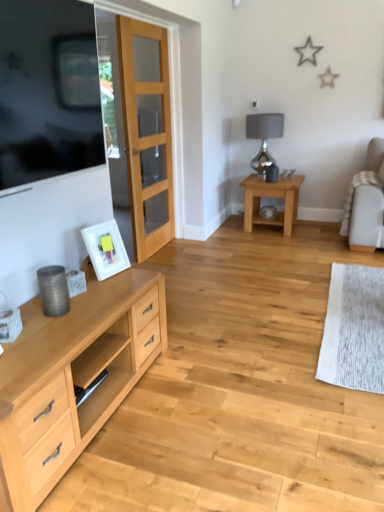
I want to click on white matte picture frame at left, so click(106, 249).

The image size is (384, 512). Describe the element at coordinates (10, 325) in the screenshot. I see `matte gray coffee cup at lower left` at that location.

Identify the location of silver metallic lamp at upper right. (264, 136).

In order to click on light brown wooden table at center-right in this screenshot , I will do `click(273, 197)`.

Measure the distance between point (142,23) and camera.

3.61 meters.

This screenshot has width=384, height=512. What do you see at coordinates (147, 133) in the screenshot?
I see `clear glass door at center` at bounding box center [147, 133].

What are the coordinates of `white matte picture frame at left` in the screenshot? It's located at [x=106, y=249].

Find the location of a particular element. chair that is behind the matte black tv at left is located at coordinates (366, 202).

From the picture: Is white fabric chair at right taller or shorter than matte black tv at left?

white fabric chair at right is shorter than matte black tv at left.

Does white fabric chair at right touch matte black tv at left?

white fabric chair at right and matte black tv at left are not in contact.

Is clear glass door at center behind white matte picture frame at left?

Yes, the depth of clear glass door at center is greater than that of white matte picture frame at left.

Based on the photo, from the image's perspective, which one is positioned lower, clear glass door at center or white matte picture frame at left?

white matte picture frame at left.

Is clear glass door at center oriented towards white matte picture frame at left?

No, clear glass door at center does not turn towards white matte picture frame at left.

Considering the relative sizes of clear glass door at center and matte gray coffee cup at lower left in the image provided, is clear glass door at center thinner than matte gray coffee cup at lower left?

No, clear glass door at center is not thinner than matte gray coffee cup at lower left.

From a real-world perspective, is clear glass door at center located beneath matte gray coffee cup at lower left?

Incorrect, from a real-world perspective, clear glass door at center is higher than matte gray coffee cup at lower left.

What's the angular difference between clear glass door at center and matte gray coffee cup at lower left's facing directions?

19.8 degrees separate the facing orientations of clear glass door at center and matte gray coffee cup at lower left.

Does point (127, 110) appear closer or farther from the camera than point (16, 322)?

Point (127, 110) is farther from the camera than point (16, 322).

Do you think light brown wooden table at center-right is within matte gray coffee cup at lower left, or outside of it?

The correct answer is: outside.

From the image's perspective, which one is positioned lower, light brown wooden table at center-right or matte gray coffee cup at lower left?

matte gray coffee cup at lower left, from the image's perspective.

Consider the image. How much distance is there between light brown wooden table at center-right and matte gray coffee cup at lower left?

light brown wooden table at center-right is 10.50 feet from matte gray coffee cup at lower left.

Locate an element on the screen. table behind the white fabric chair at right is located at coordinates (273, 197).

Is light brown wooden table at center-right not near white fabric chair at right?

light brown wooden table at center-right is actually quite close to white fabric chair at right.

Between light brown wooden table at center-right and white fabric chair at right, which one has less height?

Standing shorter between the two is light brown wooden table at center-right.

Identify the location of door located behind the white matte picture frame at left. The image size is (384, 512). (147, 133).

Considering the sizes of objects white matte picture frame at left and clear glass door at center in the image provided, who is thinner, white matte picture frame at left or clear glass door at center?

white matte picture frame at left is thinner.

From the picture: How many degrees apart are the facing directions of white matte picture frame at left and clear glass door at center?

13.1 degrees separate the facing orientations of white matte picture frame at left and clear glass door at center.

Is white matte picture frame at left located outside clear glass door at center?

Yes, white matte picture frame at left is located beyond the bounds of clear glass door at center.

Does white matte picture frame at left turn towards matte gray coffee cup at lower left?

No, white matte picture frame at left is not aimed at matte gray coffee cup at lower left.

From the image's perspective, does white matte picture frame at left appear lower than matte gray coffee cup at lower left?

Actually, white matte picture frame at left appears above matte gray coffee cup at lower left in the image.

In the image, there is a matte gray coffee cup at lower left. Where is `picture frame above it (from the image's perspective)`? picture frame above it (from the image's perspective) is located at coordinates (106, 249).

Is white matte picture frame at left thinner than matte gray coffee cup at lower left?

Incorrect, the width of white matte picture frame at left is not less than that of matte gray coffee cup at lower left.

Find the location of a particular element. This screenshot has width=384, height=512. chair on the right side of matte black tv at left is located at coordinates pyautogui.click(x=366, y=202).

Where is `picture frame in front of the clear glass door at center`? This screenshot has width=384, height=512. picture frame in front of the clear glass door at center is located at coordinates (106, 249).

Which object lies further to the anchor point matte black tv at left, matte gray coffee cup at lower left or light brown wooden table at center-right?

Based on the image, light brown wooden table at center-right appears to be further to matte black tv at left.

From the picture: From the image, which object appears to be farther from light brown wooden table at center-right, matte gray coffee cup at lower left or white fabric chair at right?

matte gray coffee cup at lower left.

From the image, which object appears to be nearer to clear glass door at center, white fabric chair at right or matte gray coffee cup at lower left?

white fabric chair at right is closer to clear glass door at center.

Which object lies further to the anchor point white fabric chair at right, white matte picture frame at left or matte black tv at left?

matte black tv at left.

Estimate the real-world distances between objects in this image. Which object is closer to white matte picture frame at left, clear glass door at center or matte gray coffee cup at lower left?

matte gray coffee cup at lower left is positioned closer to the anchor white matte picture frame at left.

Based on their spatial positions, is matte black tv at left or light brown wooden table at center-right further from white matte picture frame at left?

Based on the image, light brown wooden table at center-right appears to be further to white matte picture frame at left.

Based on their spatial positions, is clear glass door at center or silver metallic lamp at upper right closer to white matte picture frame at left?

clear glass door at center is closer to white matte picture frame at left.

From the image, which object appears to be nearer to white fabric chair at right, white matte picture frame at left or matte gray coffee cup at lower left?

white matte picture frame at left lies closer to white fabric chair at right than the other object.

Locate an element on the screen. This screenshot has height=512, width=384. coffee cup between matte black tv at left and white fabric chair at right from front to back is located at coordinates click(10, 325).

This screenshot has height=512, width=384. I want to click on picture frame between matte gray coffee cup at lower left and silver metallic lamp at upper right from front to back, so click(106, 249).

The height and width of the screenshot is (512, 384). What are the coordinates of `door between matte gray coffee cup at lower left and silver metallic lamp at upper right along the z-axis` in the screenshot? It's located at (147, 133).

Where is `chair between matte gray coffee cup at lower left and silver metallic lamp at upper right from front to back`? chair between matte gray coffee cup at lower left and silver metallic lamp at upper right from front to back is located at coordinates (366, 202).